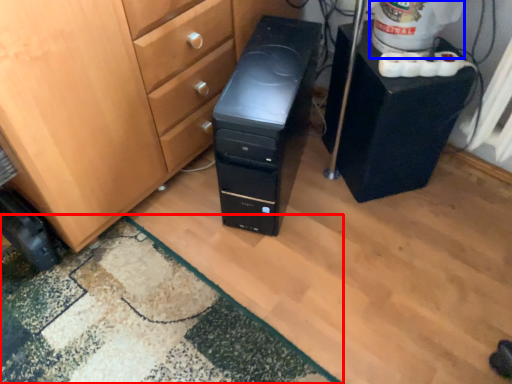
Question: Which of the following is the closest to the observer, doormat (highlighted by a red box) or water cooler (highlighted by a blue box)?

Choices:
 (A) doormat
 (B) water cooler

Answer: (A)